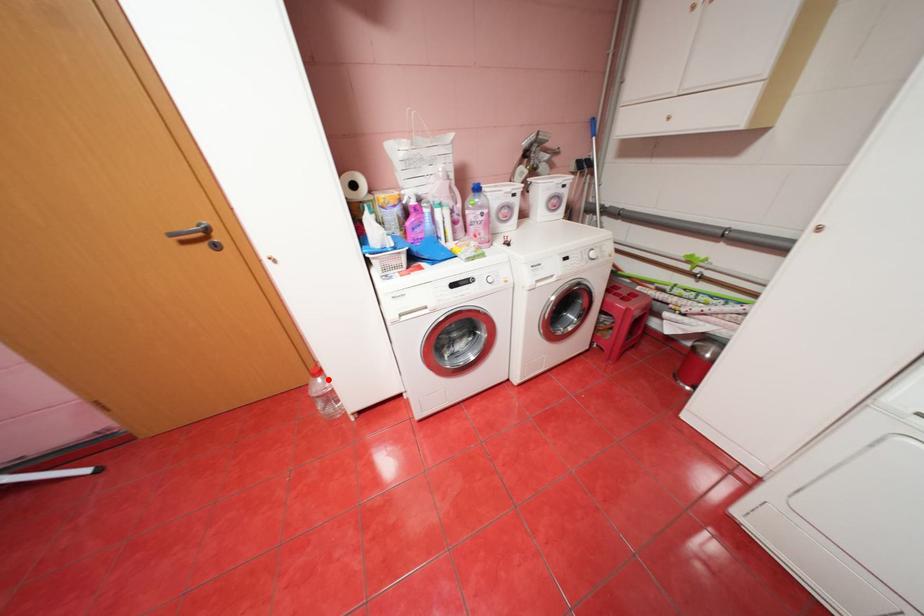
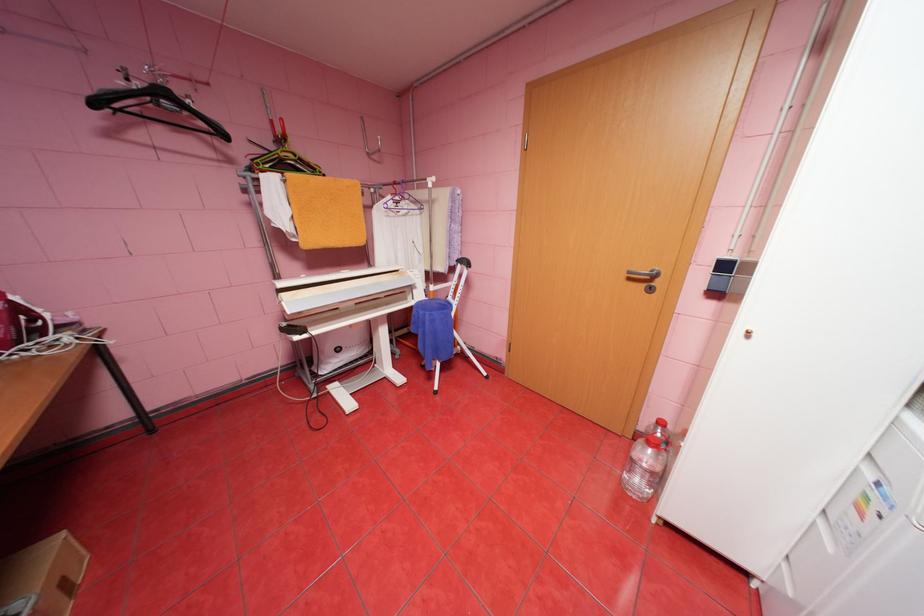
Locate, in the second image, the point that corresponds to the highlighted location in the first image.

(659, 451)